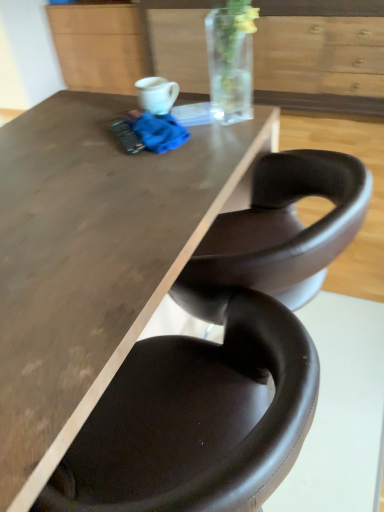
What are the coordinates of `free point above matte brown table at center (from a real-world perspective)` in the screenshot? It's located at (94, 183).